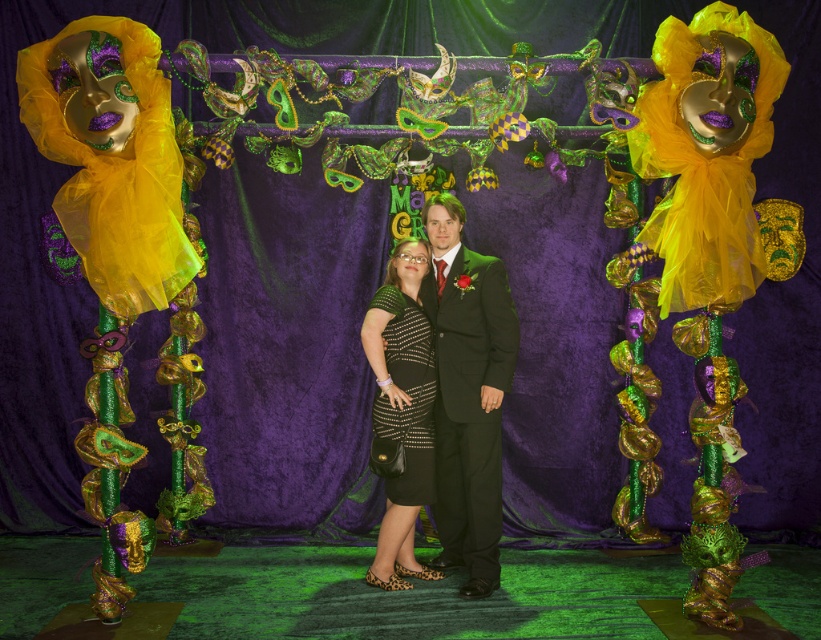
Question: Can you confirm if shiny black dress at center is positioned to the left of black sequined dress at center?

Choices:
 (A) no
 (B) yes

Answer: (A)

Question: Among these objects, which one is nearest to the camera?

Choices:
 (A) black sequined dress at center
 (B) shiny black dress at center

Answer: (B)

Question: Does shiny black dress at center come behind black sequined dress at center?

Choices:
 (A) no
 (B) yes

Answer: (A)

Question: Is shiny black dress at center further to the viewer compared to black sequined dress at center?

Choices:
 (A) yes
 (B) no

Answer: (B)

Question: Among these points, which one is nearest to the camera?

Choices:
 (A) (400, 348)
 (B) (434, 412)

Answer: (A)

Question: Among these points, which one is farthest from the camera?

Choices:
 (A) (475, 253)
 (B) (406, 278)

Answer: (A)